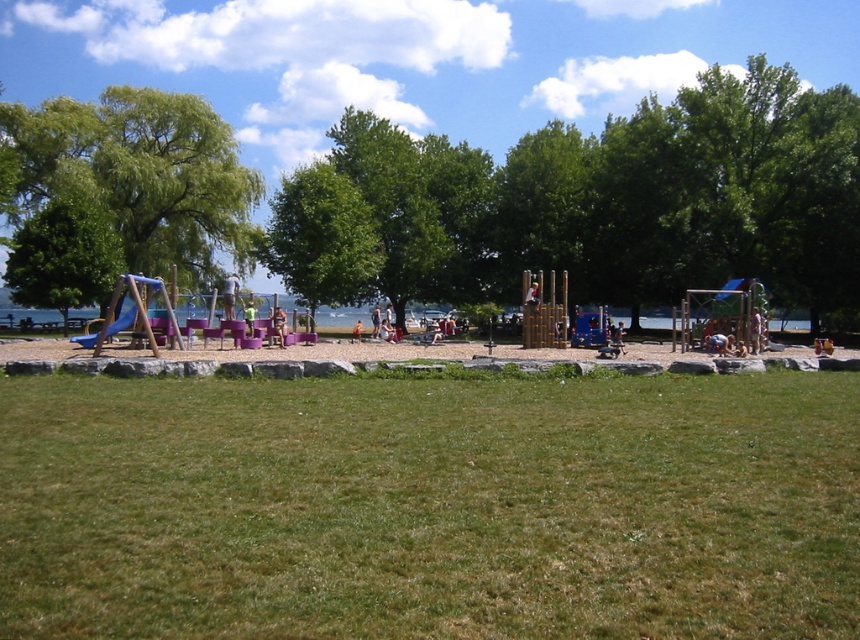
You are standing at the playground and want to walk towards the lake. You see two points marked on the ground, point (x=60, y=161) and point (x=86, y=346). Which point should you step on first to reach the lake faster?

Point (x=86, y=346) should be stepped on first because point (x=60, y=161) is behind it, meaning point (x=86, y=346) is closer to the lake.

You are standing at the center of the playground and want to locate the green leafy tree at left. According to the coordinates provided, in which direction should you look to find it?

The green leafy tree at left is located at coordinates point [121,193], which means it is positioned to the left side of the playground. Therefore, you should look to your left to find it.